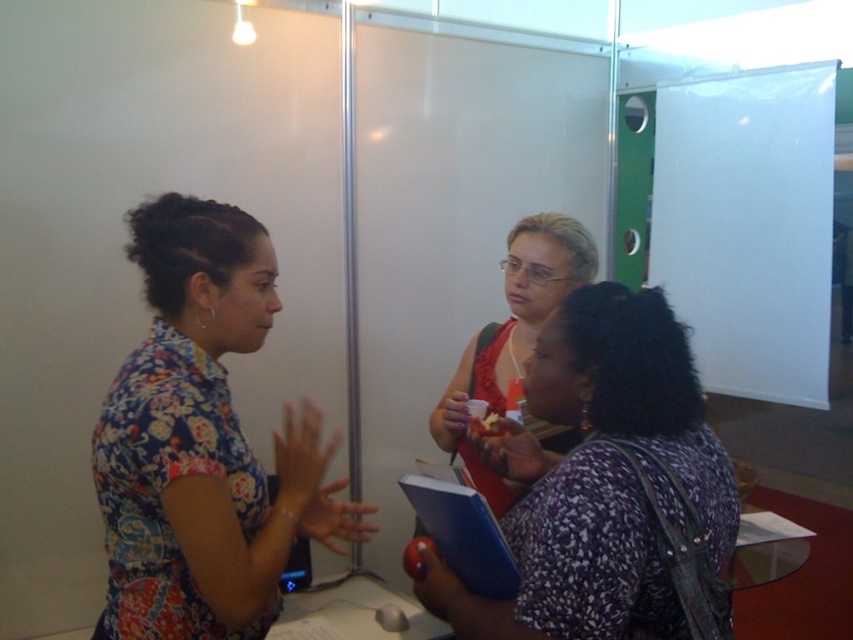
You are planning to take a photo of the floral fabric shirt at left and the matte red dress at center. Since you want both to be clearly visible in the photo, which one should you focus on first?

The floral fabric shirt at left is in front of the matte red dress at center, so you should focus on the floral fabric shirt at left first to ensure both are in focus.

You are a photographer setting up a shoot in the conference room. You need to position a backdrop that must be taller than both the floral fabric shirt at left and the matte red dress at center. What is the minimum height the backdrop should be?

The backdrop must be at least as tall as the taller of the two objects. Since the floral fabric shirt at left is taller than the matte red dress at center, the minimum height should match the height of the floral fabric shirt at left.

You are organizing a photo shoot and need to position a small prop between the speckled fabric purse at lower right and the matte red dress at center. Based on their positions, where should you place the prop to ensure it is between them?

The speckled fabric purse at lower right is below the matte red dress at center, so placing the prop between them would require positioning it horizontally between the two objects along the lower half of the dress.